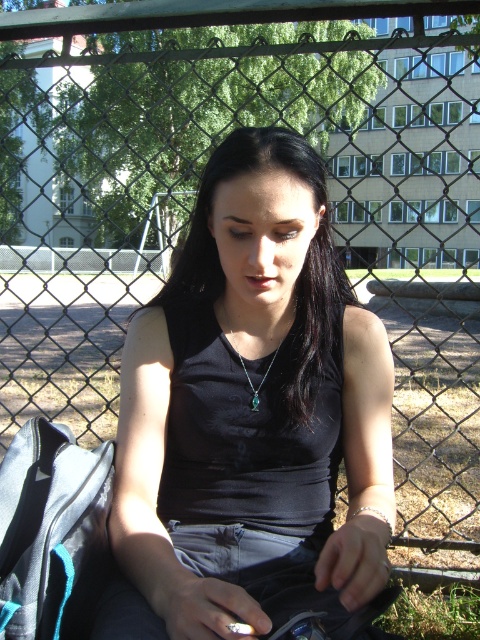
Does black matte tank top at center have a smaller size compared to emerald green gemstone at center?

No, black matte tank top at center is not smaller than emerald green gemstone at center.

Is point (188, 589) positioned in front of point (252, 400)?

Yes, point (188, 589) is closer to viewer.

Describe the element at coordinates (252, 419) in the screenshot. This screenshot has height=640, width=480. I see `black matte tank top at center` at that location.

Identify the location of black matte tank top at center. (252, 419).

Does black matte tank top at center appear on the left side of green grass at lower right?

Indeed, black matte tank top at center is positioned on the left side of green grass at lower right.

Does point (371, 468) come closer to viewer compared to point (466, 614)?

That is True.

Is point (280, 502) positioned after point (463, 605)?

No, (280, 502) is in front of (463, 605).

Where is `black matte tank top at center`? This screenshot has height=640, width=480. black matte tank top at center is located at coordinates (252, 419).

Is green grass at lower right in front of emerald green gemstone at center?

No, it is behind emerald green gemstone at center.

From the picture: Who is lower down, green grass at lower right or emerald green gemstone at center?

green grass at lower right is below.

Is point (451, 616) positioned before point (245, 376)?

No, (451, 616) is behind (245, 376).

The width and height of the screenshot is (480, 640). Identify the location of green grass at lower right. (433, 612).